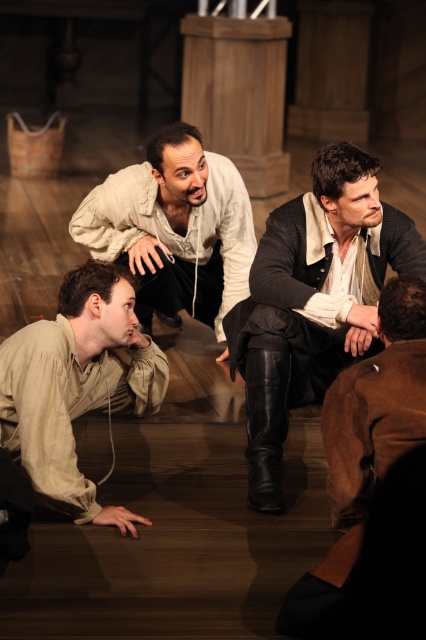
Does leather boots at center have a greater width compared to light beige leather jacket at center?

Incorrect, leather boots at center's width does not surpass light beige leather jacket at center's.

You are a GUI agent. You are given a task and a screenshot of the screen. Output one action in this format:
    pyautogui.click(x=<x>, y=<y>)
    Task: Click on the leather boots at center
    Image resolution: width=426 pixels, height=640 pixels.
    Given the screenshot: What is the action you would take?
    pyautogui.click(x=313, y=300)

Which is in front, point (40, 403) or point (397, 438)?

Positioned in front is point (397, 438).

Locate an element on the screen. The image size is (426, 640). matte beige shirt at lower left is located at coordinates (77, 385).

The height and width of the screenshot is (640, 426). I want to click on matte beige shirt at lower left, so click(x=77, y=385).

Does leather boots at center have a greater height compared to matte beige shirt at lower left?

Correct, leather boots at center is much taller as matte beige shirt at lower left.

Is leather boots at center to the left of matte beige shirt at lower left from the viewer's perspective?

In fact, leather boots at center is to the right of matte beige shirt at lower left.

Find the location of `leather boots at center`. leather boots at center is located at coordinates (313, 300).

Where is `leather boots at center`? The image size is (426, 640). leather boots at center is located at coordinates (313, 300).